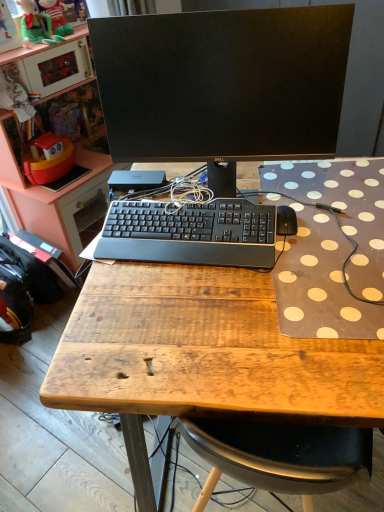
Locate an element on the screen. This screenshot has height=512, width=384. free space on the front side of black matte mouse at right is located at coordinates (299, 265).